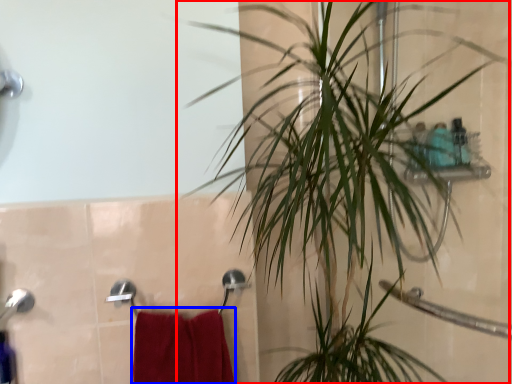
Question: Which point is further to the camera, houseplant (highlighted by a red box) or bath towel (highlighted by a blue box)?

Choices:
 (A) houseplant
 (B) bath towel

Answer: (B)